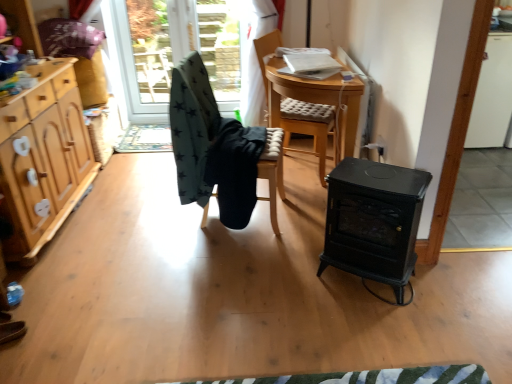
The image size is (512, 384). In order to click on vacant space situated on the left part of black fabric chair at center, the 2th chair positioned from the left in this screenshot , I will do `click(154, 217)`.